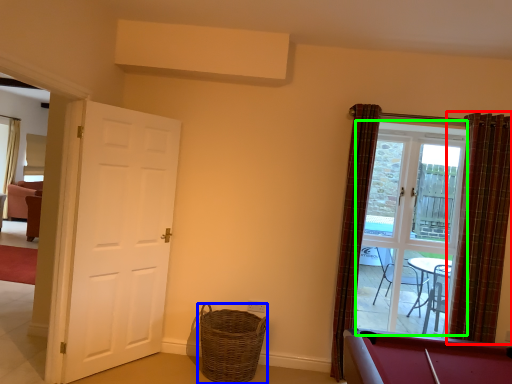
Question: Which object is the farthest from curtain (highlighted by a red box)? Choose among these: basket (highlighted by a blue box) or glass door (highlighted by a green box).

Choices:
 (A) basket
 (B) glass door

Answer: (A)